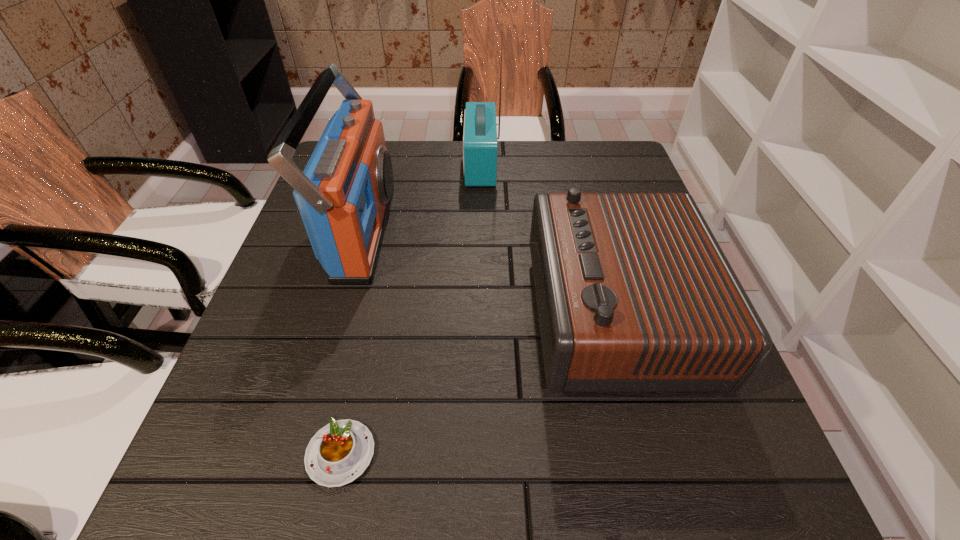
Find the location of a particular element. This screenshot has width=960, height=540. free space located on the tuning display of the shortest radio receiver is located at coordinates (415, 314).

At what (x,y) coordinates should I click in order to perform the action: click on vacant position located on the tuning display of the shortest radio receiver. Please return your answer as a coordinate pair (x, y). The image size is (960, 540). Looking at the image, I should click on (363, 314).

You are a GUI agent. You are given a task and a screenshot of the screen. Output one action in this format:
    pyautogui.click(x=<x>, y=<y>)
    Task: Click on the free space located on the tuning display of the shortest radio receiver
    The height and width of the screenshot is (540, 960).
    Given the screenshot: What is the action you would take?
    pyautogui.click(x=488, y=314)

You are a GUI agent. You are given a task and a screenshot of the screen. Output one action in this format:
    pyautogui.click(x=<x>, y=<y>)
    Task: Click on the free space located 0.100m on the left of the pudding
    The width and height of the screenshot is (960, 540).
    Given the screenshot: What is the action you would take?
    pyautogui.click(x=240, y=454)

The width and height of the screenshot is (960, 540). I want to click on object that is at the near edge, so click(340, 452).

The height and width of the screenshot is (540, 960). I want to click on object that is at the left edge, so click(344, 194).

The image size is (960, 540). What are the coordinates of `object situated at the right edge` in the screenshot? It's located at (634, 294).

At what (x,y) coordinates should I click in order to perform the action: click on object that is at the far left corner. Please return your answer as a coordinate pair (x, y). The image size is (960, 540). Looking at the image, I should click on (344, 194).

In the image, there is a desktop. Identify the location of vacant space at the far edge. (436, 178).

Find the location of a particular element. Image resolution: width=960 pixels, height=540 pixels. free region at the near edge is located at coordinates (638, 456).